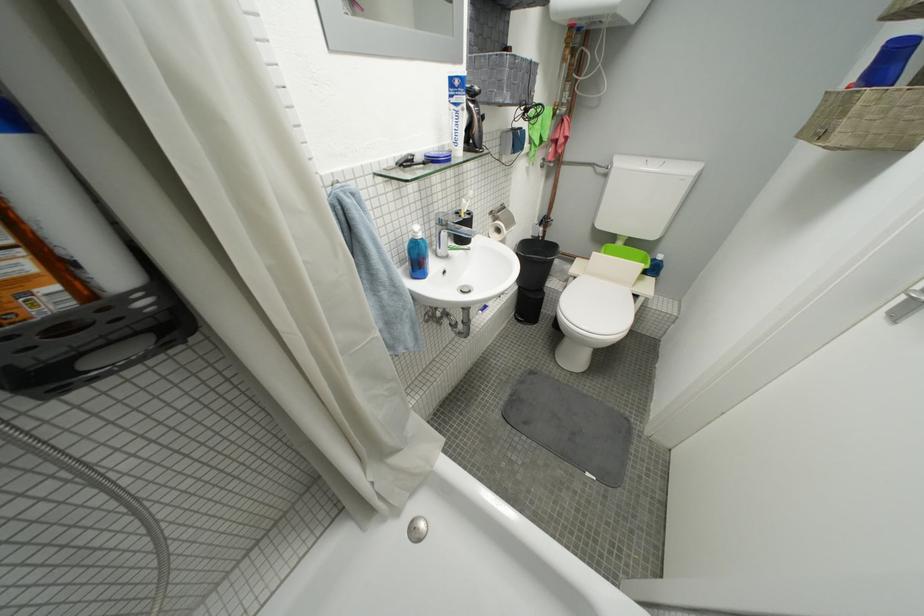
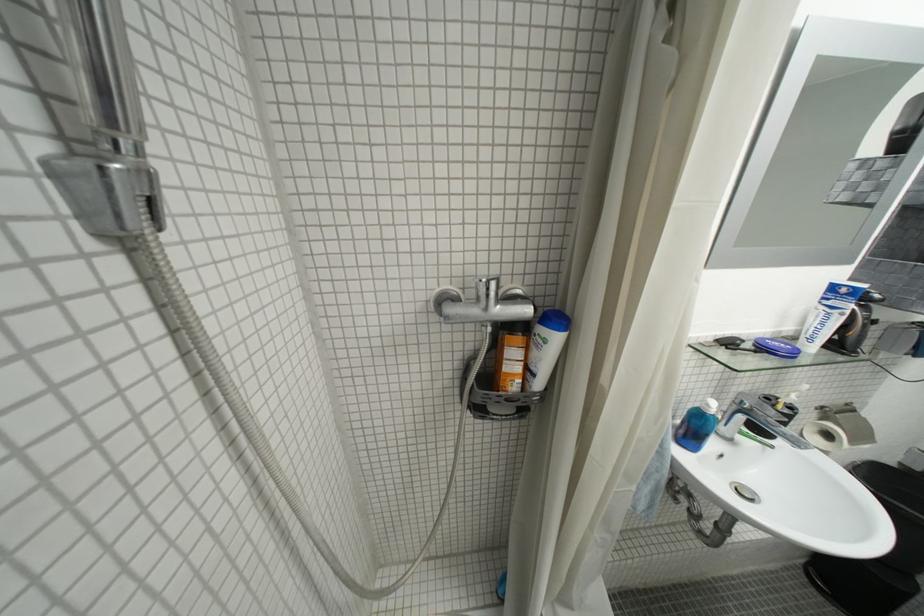
Find the pixel in the second image that matches point (459, 98) in the first image.

(833, 301)